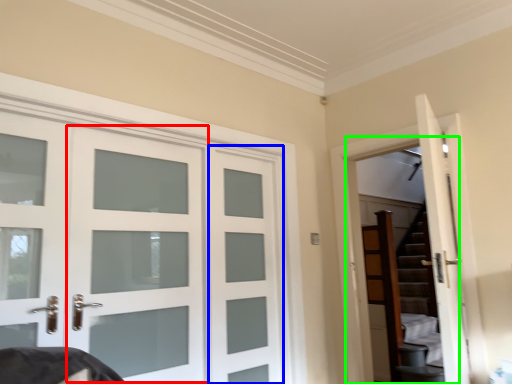
Question: Based on their relative distances, which object is farther from screen door (highlighted by a red box)? Choose from screen door (highlighted by a blue box) and garage door (highlighted by a green box).

Choices:
 (A) screen door
 (B) garage door

Answer: (B)